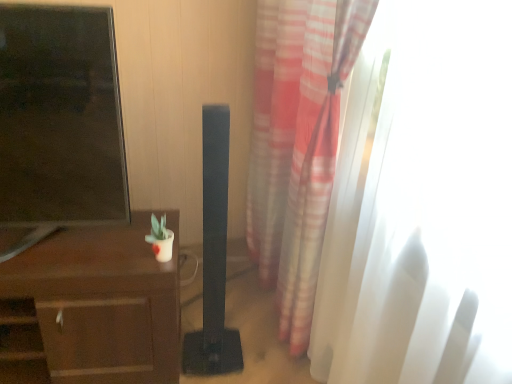
Question: From their relative heights in the image, would you say translucent white curtain at right is taller or shorter than brown wood desk at left?

Choices:
 (A) short
 (B) tall

Answer: (B)

Question: Is translucent white curtain at right to the left or to the right of brown wood desk at left in the image?

Choices:
 (A) right
 (B) left

Answer: (A)

Question: Which of these objects is positioned farthest from the black matte speaker at center?

Choices:
 (A) matte black tv at left
 (B) translucent white curtain at right
 (C) brown wood desk at left

Answer: (B)

Question: Which is nearer to the matte black tv at left?

Choices:
 (A) translucent white curtain at right
 (B) brown wood desk at left
 (C) black matte speaker at center

Answer: (B)